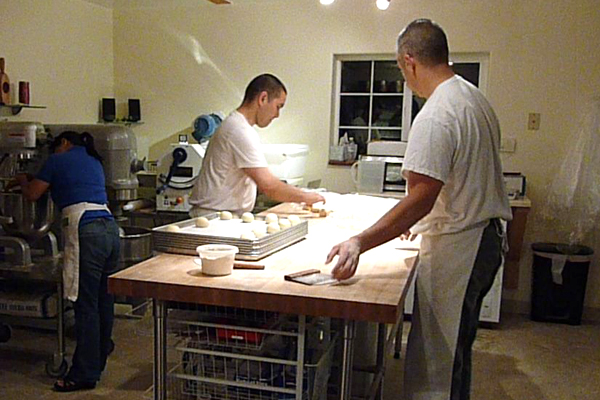
The height and width of the screenshot is (400, 600). I want to click on trash, so pos(560,295).